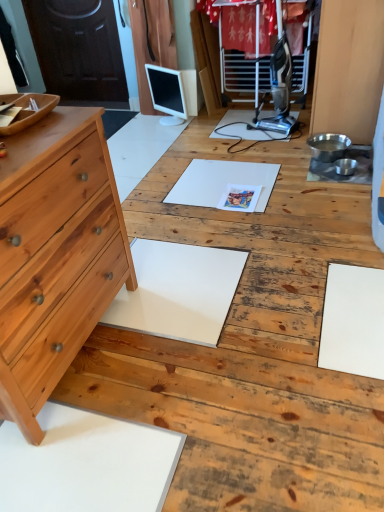
What is the approximate width of natural wood chest of drawers at left?

The width of natural wood chest of drawers at left is 16.98 inches.

Locate an element on the screen. This screenshot has height=512, width=384. natural wood chest of drawers at left is located at coordinates (56, 255).

The image size is (384, 512). What do you see at coordinates (56, 255) in the screenshot?
I see `natural wood chest of drawers at left` at bounding box center [56, 255].

Where is `white glossy computer monitor at center`? The image size is (384, 512). white glossy computer monitor at center is located at coordinates (167, 94).

The width and height of the screenshot is (384, 512). What do you see at coordinates (167, 94) in the screenshot? I see `white glossy computer monitor at center` at bounding box center [167, 94].

Measure the distance between white glossy computer monitor at center and camera.

Answer: white glossy computer monitor at center and camera are 3.30 meters apart from each other.

Where is `natural wood chest of drawers at left`? The width and height of the screenshot is (384, 512). natural wood chest of drawers at left is located at coordinates (56, 255).

Is natural wood chest of drawers at left to the left of white glossy computer monitor at center from the viewer's perspective?

Indeed, natural wood chest of drawers at left is positioned on the left side of white glossy computer monitor at center.

Does natural wood chest of drawers at left come behind white glossy computer monitor at center?

No, natural wood chest of drawers at left is closer to the camera.

Considering the points (30, 312) and (170, 121), which point is in front, point (30, 312) or point (170, 121)?

Positioned in front is point (30, 312).

From the image's perspective, would you say natural wood chest of drawers at left is shown under white glossy computer monitor at center?

Correct, natural wood chest of drawers at left appears lower than white glossy computer monitor at center in the image.

From a real-world perspective, which object rests below the other?

white glossy computer monitor at center is physically lower.

Which of these two, natural wood chest of drawers at left or white glossy computer monitor at center, is thinner?

white glossy computer monitor at center is thinner.

Considering the relative sizes of natural wood chest of drawers at left and white glossy computer monitor at center in the image provided, is natural wood chest of drawers at left taller than white glossy computer monitor at center?

Yes, natural wood chest of drawers at left is taller than white glossy computer monitor at center.

Is natural wood chest of drawers at left bigger than white glossy computer monitor at center?

Correct, natural wood chest of drawers at left is larger in size than white glossy computer monitor at center.

Looking at this image, is natural wood chest of drawers at left situated inside white glossy computer monitor at center or outside?

natural wood chest of drawers at left cannot be found inside white glossy computer monitor at center.

Is natural wood chest of drawers at left positioned far away from white glossy computer monitor at center?

That's right, there is a large distance between natural wood chest of drawers at left and white glossy computer monitor at center.

Is natural wood chest of drawers at left positioned with its back to white glossy computer monitor at center?

No, natural wood chest of drawers at left is not facing the opposite direction of white glossy computer monitor at center.

Measure the distance between natural wood chest of drawers at left and white glossy computer monitor at center.

They are 7.54 feet apart.

Locate an element on the screen. The width and height of the screenshot is (384, 512). chest of drawers above the white glossy computer monitor at center (from a real-world perspective) is located at coordinates (56, 255).

Between white glossy computer monitor at center and natural wood chest of drawers at left, which one appears on the right side from the viewer's perspective?

white glossy computer monitor at center.

Does white glossy computer monitor at center come in front of natural wood chest of drawers at left?

No, the depth of white glossy computer monitor at center is greater than that of natural wood chest of drawers at left.

Is point (157, 91) closer to viewer compared to point (116, 211)?

No, it is behind (116, 211).

From the image's perspective, which object appears higher, white glossy computer monitor at center or natural wood chest of drawers at left?

white glossy computer monitor at center appears higher in the image.

From a real-world perspective, relative to natural wood chest of drawers at left, is white glossy computer monitor at center vertically above or below?

white glossy computer monitor at center is situated lower than natural wood chest of drawers at left in the real world.

Can you confirm if white glossy computer monitor at center is thinner than natural wood chest of drawers at left?

Yes.

Which of these two, white glossy computer monitor at center or natural wood chest of drawers at left, stands taller?

natural wood chest of drawers at left.

Does white glossy computer monitor at center have a larger size compared to natural wood chest of drawers at left?

Incorrect, white glossy computer monitor at center is not larger than natural wood chest of drawers at left.

Does white glossy computer monitor at center contain natural wood chest of drawers at left?

No.

Is white glossy computer monitor at center positioned far away from natural wood chest of drawers at left?

white glossy computer monitor at center is far away from natural wood chest of drawers at left.

Is white glossy computer monitor at center turned away from natural wood chest of drawers at left?

No, white glossy computer monitor at center's orientation is not away from natural wood chest of drawers at left.

How much distance is there between white glossy computer monitor at center and natural wood chest of drawers at left?

2.30 meters.

Locate an element on the screen. chest of drawers above the white glossy computer monitor at center (from a real-world perspective) is located at coordinates (56, 255).

At what (x,y) coordinates should I click in order to perform the action: click on chest of drawers that is on the left side of white glossy computer monitor at center. Please return your answer as a coordinate pair (x, y). Looking at the image, I should click on (56, 255).

I want to click on the chest of drawers above the white glossy computer monitor at center (from a real-world perspective), so click(x=56, y=255).